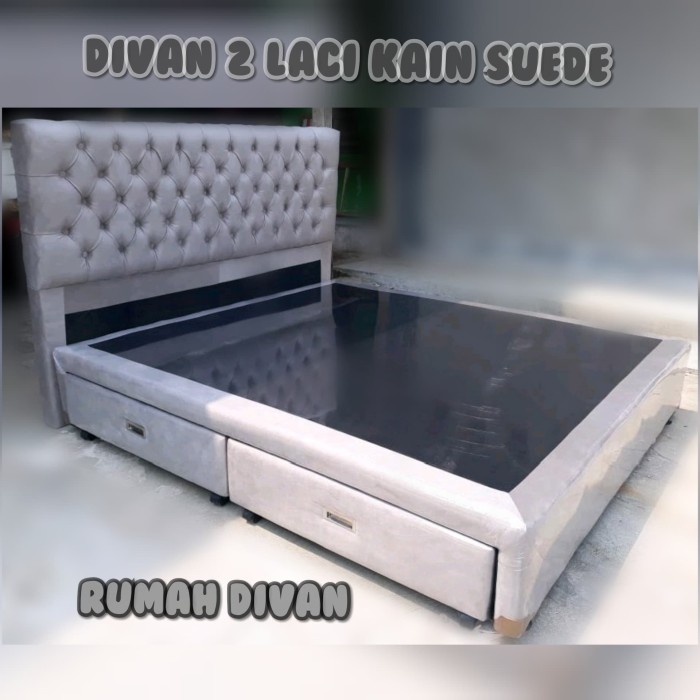
Identify the location of black bed frame. This screenshot has width=700, height=700. (418, 365).